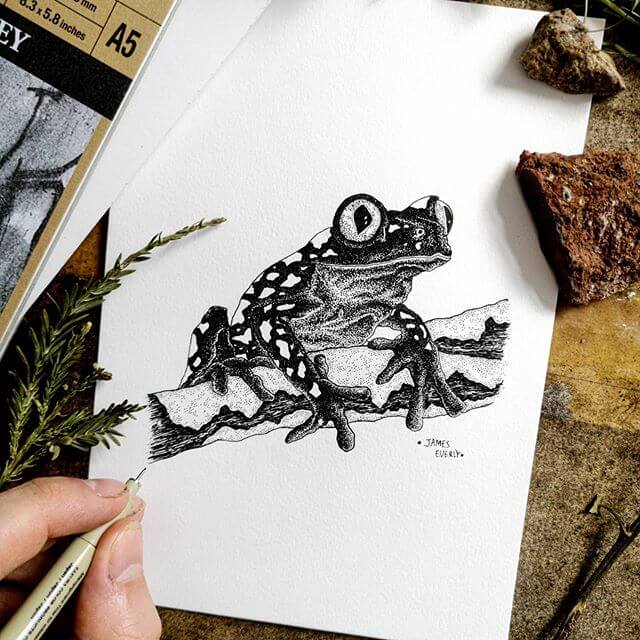
Where is `plant`? plant is located at coordinates (58, 383).